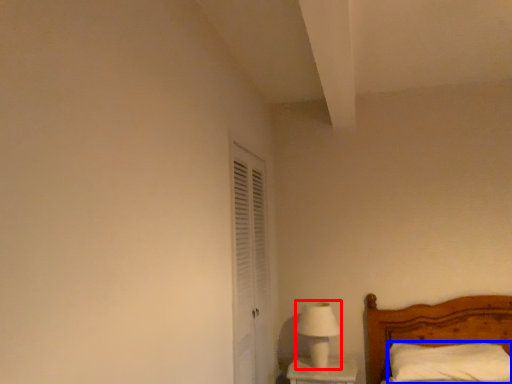
Question: Which point is closer to the camera, table lamp (highlighted by a red box) or pillow (highlighted by a blue box)?

Choices:
 (A) table lamp
 (B) pillow

Answer: (B)